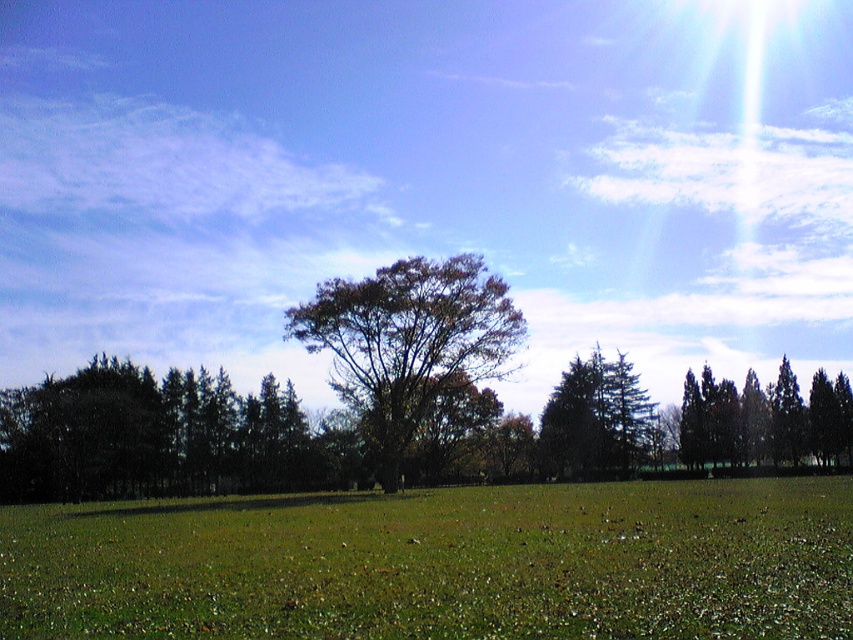
Question: Estimate the real-world distances between objects in this image. Which object is closer to the dark green leafy tree at left?

Choices:
 (A) green glossy trees at right
 (B) green grassy field at center
 (C) green leafy tree at center

Answer: (C)

Question: Does green grassy field at center have a greater width compared to green glossy trees at right?

Choices:
 (A) yes
 (B) no

Answer: (A)

Question: Does green leafy tree at center appear over green glossy trees at right?

Choices:
 (A) yes
 (B) no

Answer: (A)

Question: Among these points, which one is farthest from the camera?

Choices:
 (A) (x=331, y=344)
 (B) (x=775, y=458)
 (C) (x=437, y=496)

Answer: (B)

Question: Which is farther from the green glossy trees at right?

Choices:
 (A) green grassy field at center
 (B) green leafy tree at center
 (C) dark green leafy tree at left

Answer: (C)

Question: Can you confirm if green grassy field at center is bigger than dark green leafy tree at left?

Choices:
 (A) no
 (B) yes

Answer: (B)